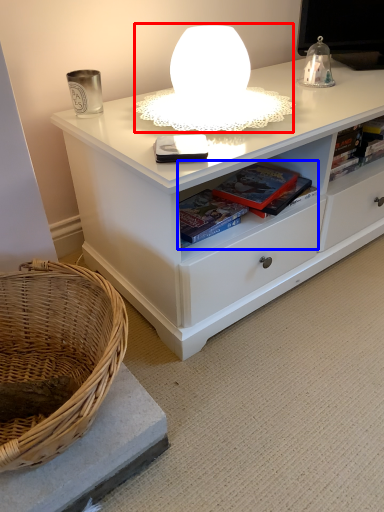
Question: Which object appears farthest to the camera in this image, table lamp (highlighted by a red box) or book (highlighted by a blue box)?

Choices:
 (A) table lamp
 (B) book

Answer: (B)